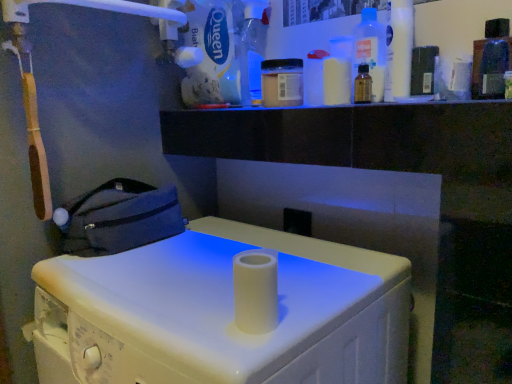
Question: Considering the relative positions of dark blue fabric bag at left and white plastic bottle at upper center, the 4th bottle viewed from the right, in the image provided, is dark blue fabric bag at left behind white plastic bottle at upper center, the 4th bottle viewed from the right,?

Choices:
 (A) no
 (B) yes

Answer: (A)

Question: Can you confirm if dark blue fabric bag at left is smaller than white plastic bottle at upper center, the second bottle viewed from the left?

Choices:
 (A) yes
 (B) no

Answer: (B)

Question: Considering the relative sizes of dark blue fabric bag at left and white plastic bottle at upper center, the second bottle viewed from the left, in the image provided, is dark blue fabric bag at left shorter than white plastic bottle at upper center, the second bottle viewed from the left,?

Choices:
 (A) no
 (B) yes

Answer: (B)

Question: Is dark blue fabric bag at left oriented towards white plastic bottle at upper center, the second bottle viewed from the left?

Choices:
 (A) yes
 (B) no

Answer: (B)

Question: Does dark blue fabric bag at left lie in front of white plastic bottle at upper center, the 4th bottle viewed from the right?

Choices:
 (A) yes
 (B) no

Answer: (A)

Question: Can you see dark blue fabric bag at left touching white plastic bottle at upper center, the second bottle viewed from the left?

Choices:
 (A) yes
 (B) no

Answer: (B)

Question: Is white plastic bottle at upper center, the second bottle viewed from the left, next to white matte queen bath cleaner at upper center?

Choices:
 (A) no
 (B) yes

Answer: (A)

Question: From a real-world perspective, is white plastic bottle at upper center, the 4th bottle viewed from the right, beneath white matte queen bath cleaner at upper center?

Choices:
 (A) no
 (B) yes

Answer: (B)

Question: Is white plastic bottle at upper center, the second bottle viewed from the left, in front of white matte queen bath cleaner at upper center?

Choices:
 (A) yes
 (B) no

Answer: (A)

Question: Is white plastic bottle at upper center, the second bottle viewed from the left, thinner than white matte queen bath cleaner at upper center?

Choices:
 (A) no
 (B) yes

Answer: (B)

Question: From the image's perspective, would you say white plastic bottle at upper center, the 4th bottle viewed from the right, is shown under white matte queen bath cleaner at upper center?

Choices:
 (A) yes
 (B) no

Answer: (A)

Question: Is white plastic bottle at upper center, the 4th bottle viewed from the right, positioned beyond the bounds of white matte queen bath cleaner at upper center?

Choices:
 (A) yes
 (B) no

Answer: (A)

Question: Can you confirm if translucent plastic bottle at upper right, which is the fifth bottle in left-to-right order, is shorter than transparent plastic bottle at upper right, which is counted as the 4th bottle, starting from the left?

Choices:
 (A) no
 (B) yes

Answer: (B)